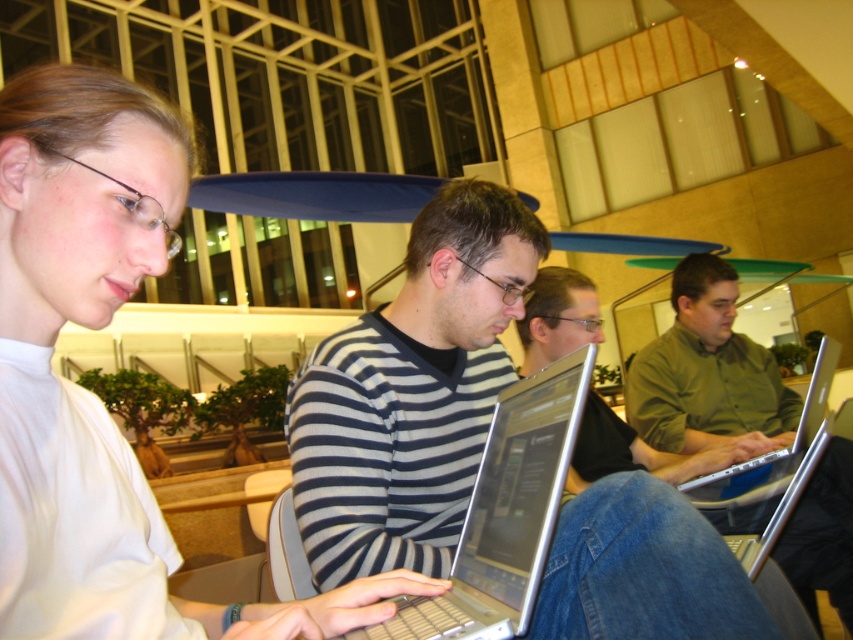
Measure the distance between point (21,330) and camera.

29.10 inches

Is point (180, 204) closer to viewer compared to point (764, 428)?

Yes.

I want to click on matte white shirt at left, so click(84, 390).

Which of these two, striped sweater at center or silver metallic laptop at right, stands taller?

striped sweater at center

Can you confirm if striped sweater at center is positioned above silver metallic laptop at right?

Indeed, striped sweater at center is positioned over silver metallic laptop at right.

Find the location of a particular element. striped sweater at center is located at coordinates (410, 392).

Who is positioned more to the right, matte white shirt at left or silver metallic laptop at center?

silver metallic laptop at center

Which is above, matte white shirt at left or silver metallic laptop at center?

matte white shirt at left

The height and width of the screenshot is (640, 853). What do you see at coordinates (84, 390) in the screenshot?
I see `matte white shirt at left` at bounding box center [84, 390].

Locate an element on the screen. The height and width of the screenshot is (640, 853). matte white shirt at left is located at coordinates (84, 390).